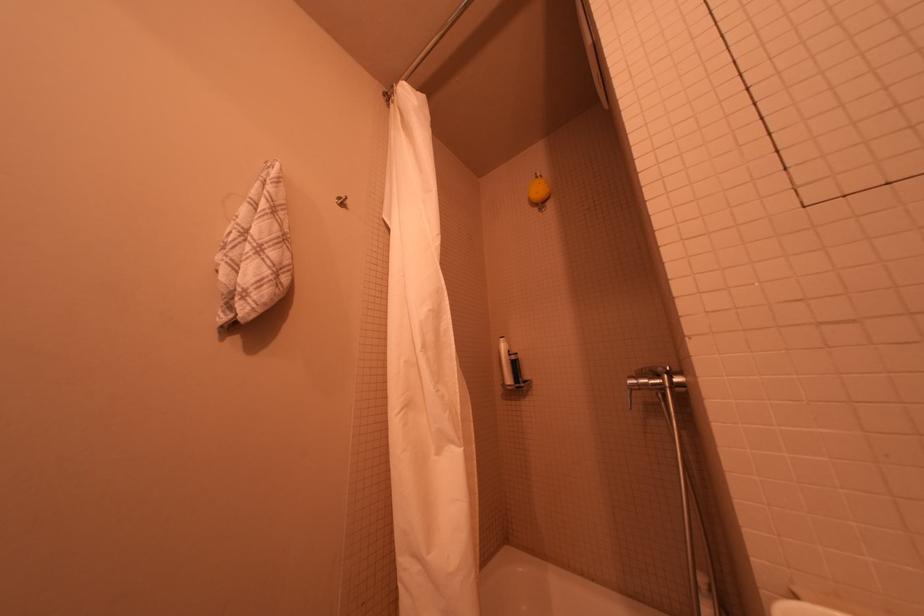
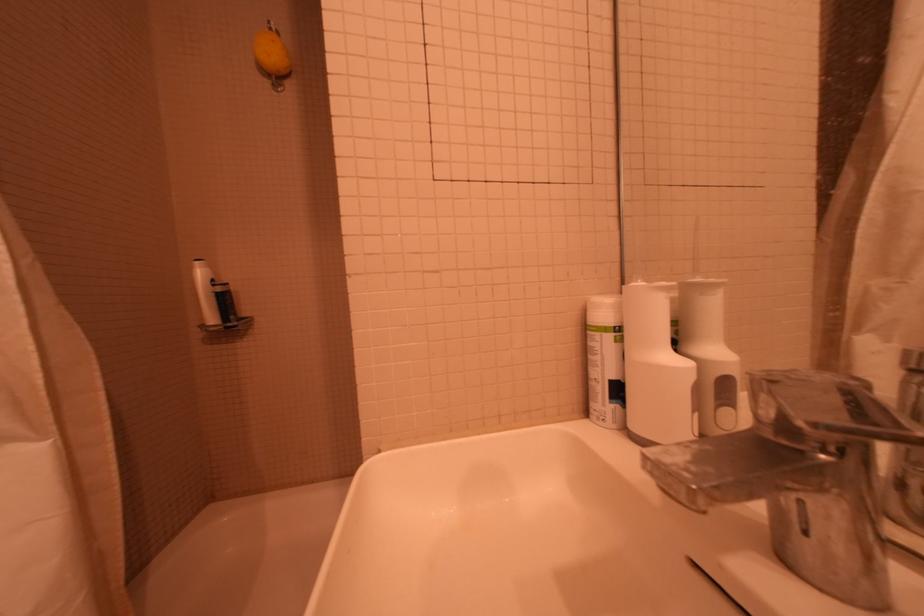
Question: Based on the continuous images, in which direction is the camera rotating? Reply with the corresponding letter.

Choices:
 (A) Left
 (B) Right
 (C) Up
 (D) Down

Answer: (B)